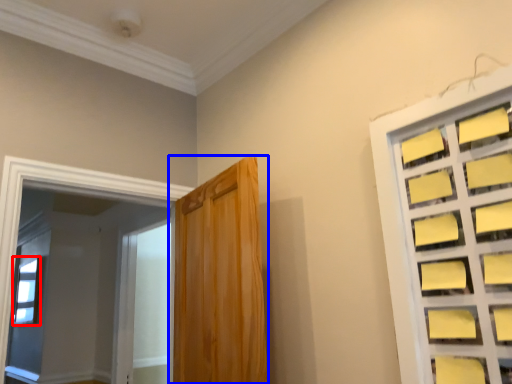
Question: Which object appears farthest to the camera in this image, window (highlighted by a red box) or door (highlighted by a blue box)?

Choices:
 (A) window
 (B) door

Answer: (A)